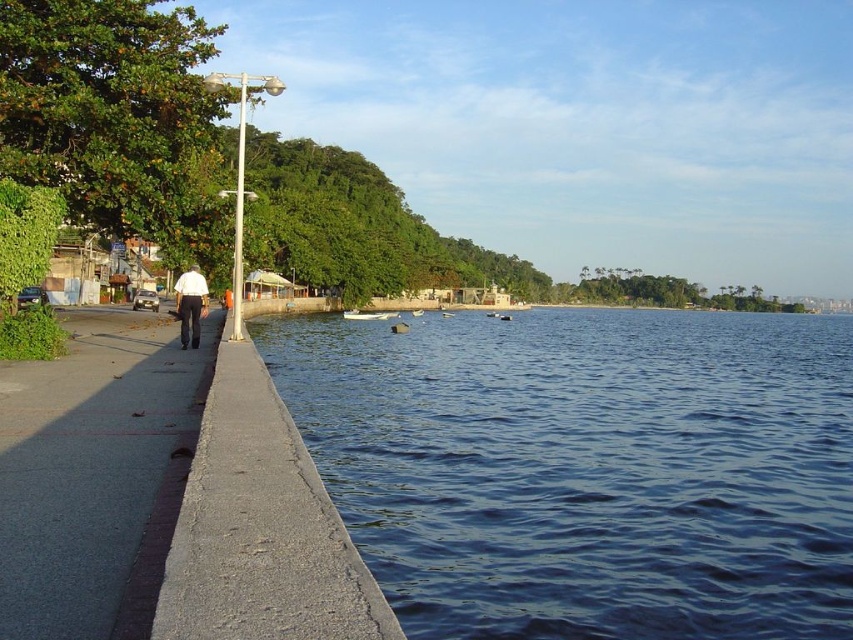
Is metallic pole at left to the left of white shirt at left from the viewer's perspective?

Yes, metallic pole at left is to the left of white shirt at left.

Is point (236, 161) farther from camera compared to point (196, 320)?

Yes, it is.

Does point (244, 120) come farther from viewer compared to point (192, 275)?

Yes.

Identify the location of metallic pole at left. The height and width of the screenshot is (640, 853). tap(238, 209).

Which of these two, dark blue water at lower left or gray concrete sidewalk at left, stands taller?

dark blue water at lower left

From the picture: Can you confirm if dark blue water at lower left is shorter than gray concrete sidewalk at left?

Incorrect, dark blue water at lower left's height does not fall short of gray concrete sidewalk at left's.

Is point (672, 365) farther from viewer compared to point (171, 404)?

That is True.

Locate an element on the screen. dark blue water at lower left is located at coordinates (585, 468).

Who is taller, dark blue water at lower left or metallic pole at left?

metallic pole at left is taller.

Can you confirm if dark blue water at lower left is bigger than metallic pole at left?

No, dark blue water at lower left is not bigger than metallic pole at left.

Who is more forward, (793, 365) or (245, 92)?

Point (245, 92) is in front.

I want to click on dark blue water at lower left, so click(585, 468).